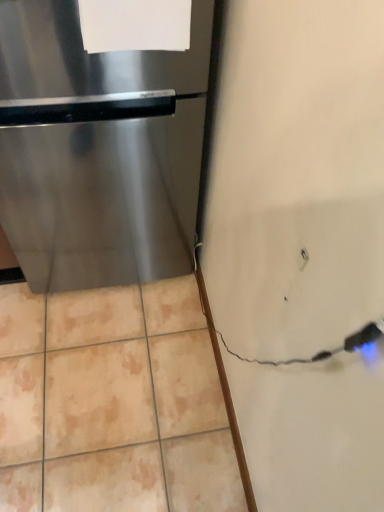
The width and height of the screenshot is (384, 512). Describe the element at coordinates (99, 154) in the screenshot. I see `stainless steel refrigerator at left` at that location.

I want to click on stainless steel refrigerator at left, so click(x=99, y=154).

What do you see at coordinates (135, 25) in the screenshot? I see `white paper at upper center` at bounding box center [135, 25].

Where is `white paper at upper center`? This screenshot has height=512, width=384. white paper at upper center is located at coordinates (135, 25).

Image resolution: width=384 pixels, height=512 pixels. I want to click on stainless steel refrigerator at left, so click(x=99, y=154).

Which is more to the left, white paper at upper center or stainless steel refrigerator at left?

stainless steel refrigerator at left.

Does white paper at upper center lie behind stainless steel refrigerator at left?

No, white paper at upper center is closer to the camera.

Does point (166, 8) come in front of point (69, 83)?

Yes, it is in front of point (69, 83).

From the image's perspective, is white paper at upper center on stainless steel refrigerator at left?

Yes.

From a real-world perspective, is white paper at upper center physically above stainless steel refrigerator at left?

Correct, in the physical world, white paper at upper center is higher than stainless steel refrigerator at left.

Based on the photo, between white paper at upper center and stainless steel refrigerator at left, which one has smaller width?

white paper at upper center.

Considering the relative sizes of white paper at upper center and stainless steel refrigerator at left in the image provided, is white paper at upper center taller than stainless steel refrigerator at left?

Incorrect, the height of white paper at upper center is not larger of that of stainless steel refrigerator at left.

Is white paper at upper center smaller than stainless steel refrigerator at left?

Indeed, white paper at upper center has a smaller size compared to stainless steel refrigerator at left.

Is white paper at upper center situated inside stainless steel refrigerator at left or outside?

The correct answer is: inside.

Is white paper at upper center in contact with stainless steel refrigerator at left?

No, white paper at upper center is not beside stainless steel refrigerator at left.

Could you tell me if white paper at upper center is facing stainless steel refrigerator at left?

No, white paper at upper center is not facing towards stainless steel refrigerator at left.

How different are the orientations of white paper at upper center and stainless steel refrigerator at left in degrees?

There is a 2.91-degree angle between the facing directions of white paper at upper center and stainless steel refrigerator at left.

The image size is (384, 512). What are the coordinates of `refrigerator to the left of white paper at upper center` in the screenshot? It's located at (99, 154).

From the picture: Which object is positioned more to the right, stainless steel refrigerator at left or white paper at upper center?

Positioned to the right is white paper at upper center.

Is the position of stainless steel refrigerator at left less distant than that of white paper at upper center?

No, stainless steel refrigerator at left is behind white paper at upper center.

Is point (8, 160) behind point (187, 5)?

Yes, it is.

In the scene shown: From the image's perspective, is stainless steel refrigerator at left below white paper at upper center?

Correct, stainless steel refrigerator at left appears lower than white paper at upper center in the image.

Based on the photo, from a real-world perspective, which is physically below, stainless steel refrigerator at left or white paper at upper center?

From a 3D spatial view, stainless steel refrigerator at left is below.

Can you confirm if stainless steel refrigerator at left is thinner than white paper at upper center?

No, stainless steel refrigerator at left is not thinner than white paper at upper center.

Considering the sizes of objects stainless steel refrigerator at left and white paper at upper center in the image provided, who is taller, stainless steel refrigerator at left or white paper at upper center?

With more height is stainless steel refrigerator at left.

Consider the image. Is stainless steel refrigerator at left bigger than white paper at upper center?

Yes, stainless steel refrigerator at left is bigger than white paper at upper center.

Which is correct: stainless steel refrigerator at left is inside white paper at upper center, or outside of it?

stainless steel refrigerator at left is not enclosed by white paper at upper center.

Is stainless steel refrigerator at left directly adjacent to white paper at upper center?

stainless steel refrigerator at left is not next to white paper at upper center, and they're not touching.

Is white paper at upper center at the back of stainless steel refrigerator at left?

stainless steel refrigerator at left does not have its back to white paper at upper center.

I want to click on refrigerator that appears behind the white paper at upper center, so click(99, 154).

The height and width of the screenshot is (512, 384). I want to click on paper lying on the right of stainless steel refrigerator at left, so click(x=135, y=25).

Find the location of a particular element. refrigerator behind the white paper at upper center is located at coordinates (99, 154).